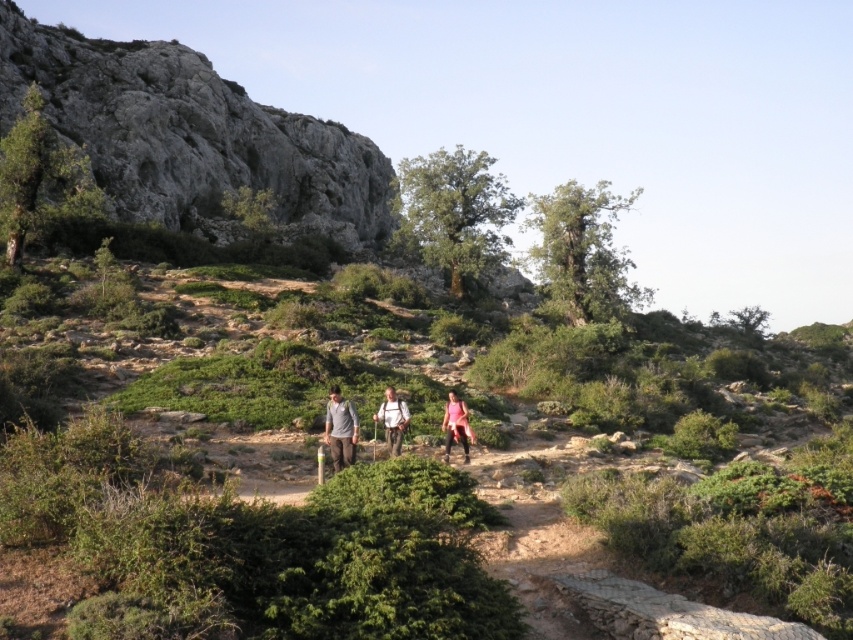
Based on the photo, can you confirm if light brown leather backpack at center is positioned above pink fabric at center?

Correct, light brown leather backpack at center is located above pink fabric at center.

Can you confirm if light brown leather backpack at center is wider than pink fabric at center?

Yes.

Does point (403, 412) come farther from viewer compared to point (462, 410)?

No, (403, 412) is closer to viewer.

I want to click on light brown leather backpack at center, so click(x=392, y=420).

The height and width of the screenshot is (640, 853). Identify the location of green leafy tree at center. (456, 209).

Identify the location of green leafy tree at center. The height and width of the screenshot is (640, 853). (456, 209).

This screenshot has height=640, width=853. I want to click on green leafy tree at center, so click(456, 209).

Is rugged stone hillside at upper left above green leafy tree at center?

No.

Can you confirm if rugged stone hillside at upper left is positioned to the right of green leafy tree at center?

In fact, rugged stone hillside at upper left is to the left of green leafy tree at center.

Between point (250, 182) and point (518, 200), which one is positioned in front?

Positioned in front is point (518, 200).

The height and width of the screenshot is (640, 853). Identify the location of rugged stone hillside at upper left. (190, 134).